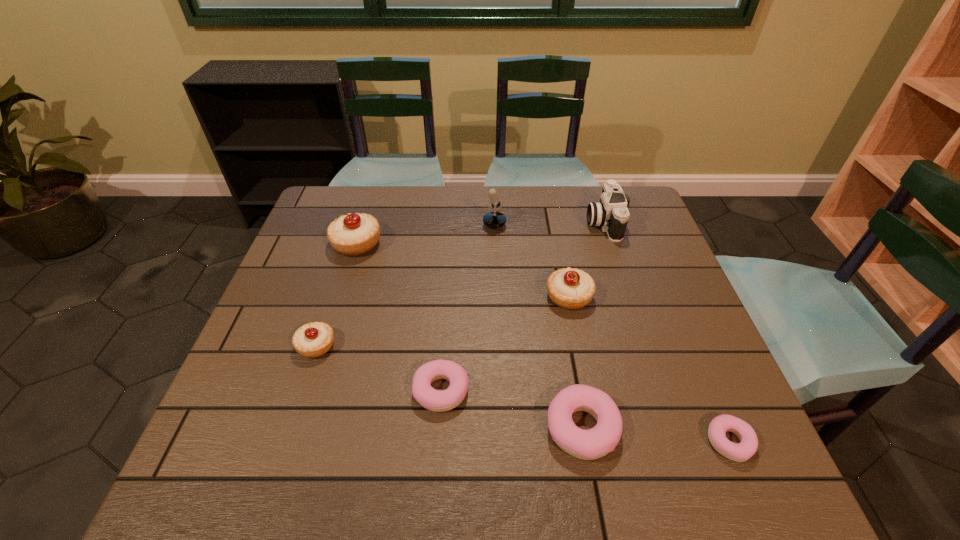
Image resolution: width=960 pixels, height=540 pixels. I want to click on the sixth tallest object, so click(590, 444).

Where is `the leftmost pink pastry`? the leftmost pink pastry is located at coordinates (435, 400).

Where is `the second smallest pink pastry`? the second smallest pink pastry is located at coordinates (435, 400).

The height and width of the screenshot is (540, 960). Identify the location of the shortest object. (748, 445).

Locate an element on the screen. the smallest pink pastry is located at coordinates (748, 445).

Find the location of a particular element. This screenshot has height=540, width=960. free spot located on the front of the microphone is located at coordinates (477, 277).

Locate an element on the screen. This screenshot has width=960, height=540. free location located 0.340m on the left of the camera is located at coordinates (476, 222).

Identify the location of free spot located on the right of the tallest pastry. This screenshot has width=960, height=540. (447, 244).

I want to click on vacant point located on the back of the rightmost beige pastry, so click(x=564, y=268).

The image size is (960, 540). What are the coordinates of `free space located on the back of the nearest beige pastry` in the screenshot? It's located at (336, 286).